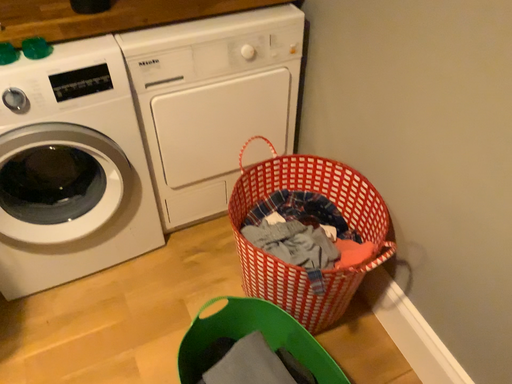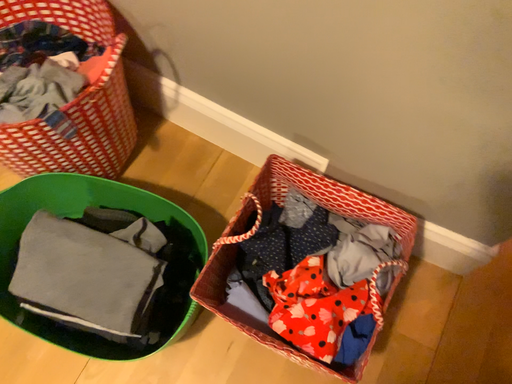
Question: Which way did the camera rotate in the video?

Choices:
 (A) rotated upward
 (B) rotated downward

Answer: (B)